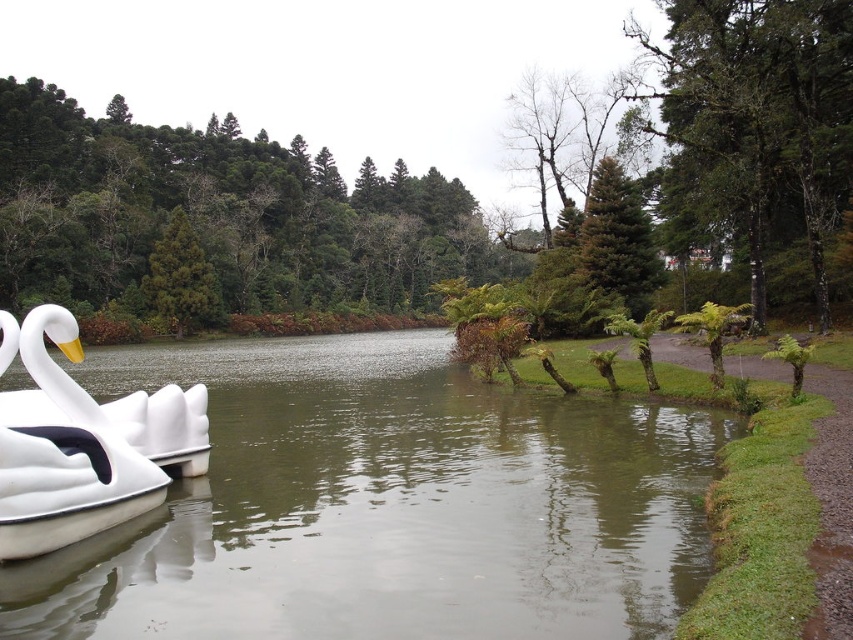
You are a visitor standing on the lakeside path and see the green smooth water at left and the white matte swan at left. Which object is closer to your left side?

The green smooth water at left is closer to your left side because it is positioned to the left of the white matte swan at left.

You are standing at the edge of the lake and want to place a small floating dock between the green smooth water at left and the white swan shaped paddle boat at right. The dock requires a minimum of 15 feet of space to be safely anchored. Can the dock be placed between them?

The distance between the green smooth water at left and the white swan shaped paddle boat at right is 17.02 feet, which is more than the required 15 feet. Therefore, the dock can be safely placed between them.

You are standing at the lakeside and see the green smooth water at left and the white matte swan at left. Which object appears taller from your viewpoint?

The white matte swan at left appears taller than the green smooth water at left because the description states that the green smooth water at left has a lesser height compared to the white matte swan at left.